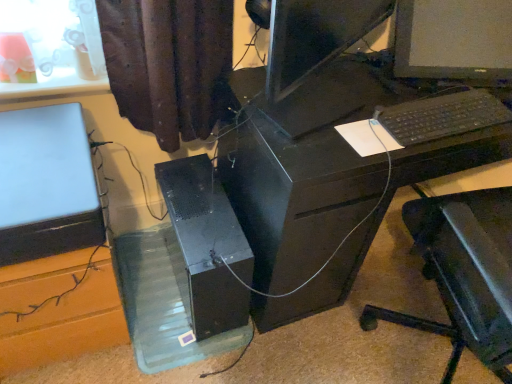
Locate an element on the screen. Image resolution: width=512 pixels, height=384 pixels. vacant region above satin black laptop at left (from a real-world perspective) is located at coordinates (40, 161).